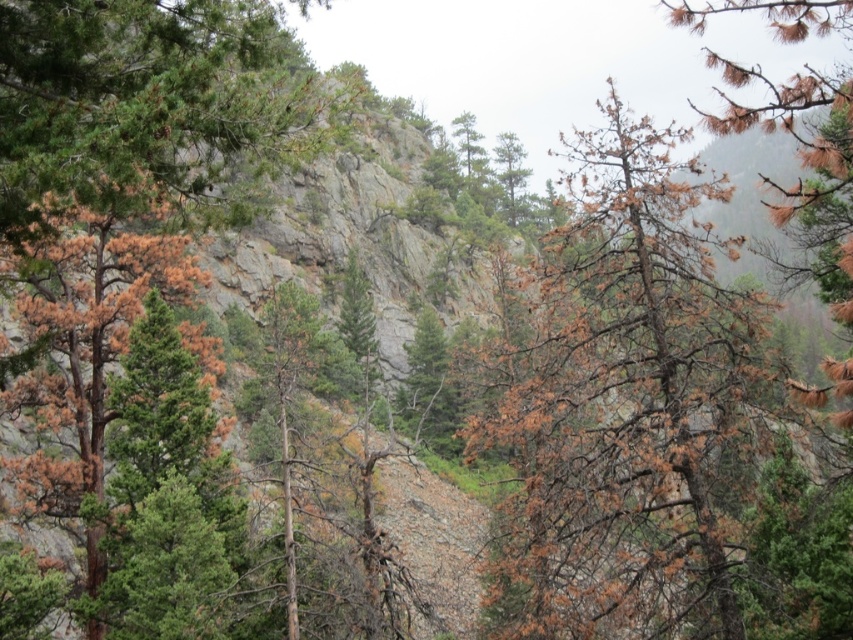
You are a hiker planning to cross between the green matte tree at upper left and the brown textured tree at left. Your backpack is 2 meters wide. Can you safely pass through the gap between them?

The gap between the green matte tree at upper left and the brown textured tree at left is 4.46 meters, which is wider than your 2 meter backpack. Therefore, you can safely pass through the gap between them.

You are a hiker trying to navigate through the mountainous area shown in the image. You see a point labeled as point (628, 406). What is the significance of this point in the scene?

Point (628, 406) marks brown dried needles at right, indicating the presence of dried vegetation in that area.